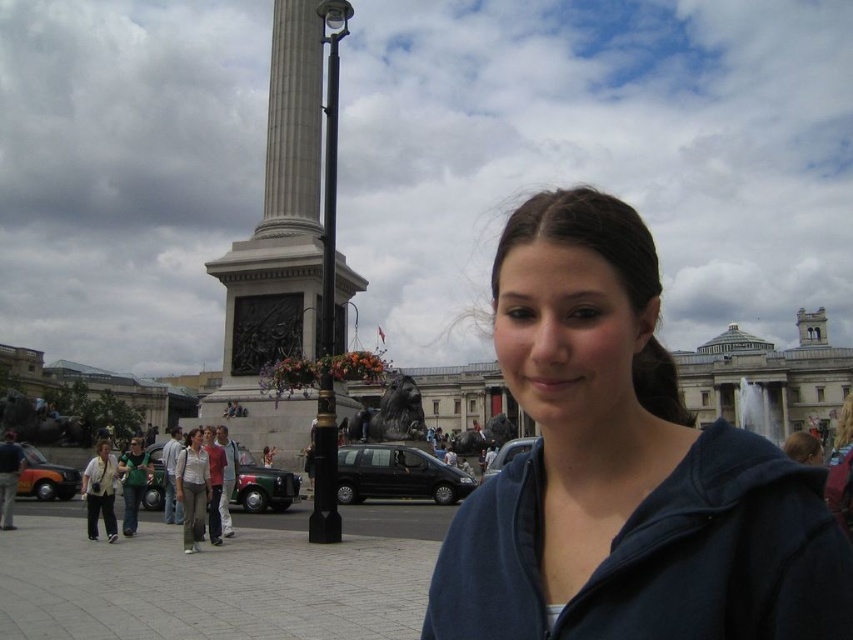
Does blue fleece jacket at center have a greater height compared to light brown pants at lower left?

Correct, blue fleece jacket at center is much taller as light brown pants at lower left.

Does point (564, 518) come farther from viewer compared to point (190, 493)?

No, it is in front of (190, 493).

I want to click on blue fleece jacket at center, so click(x=624, y=468).